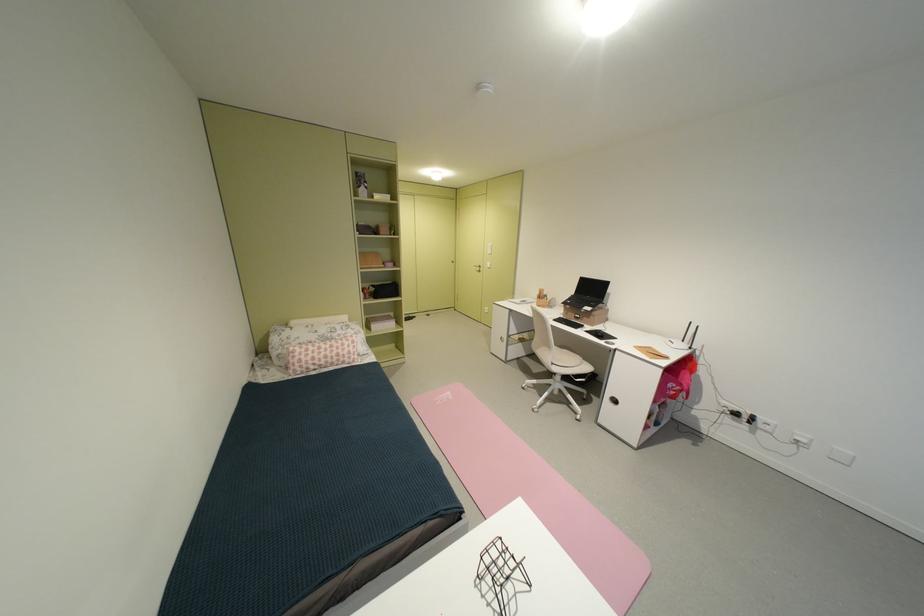
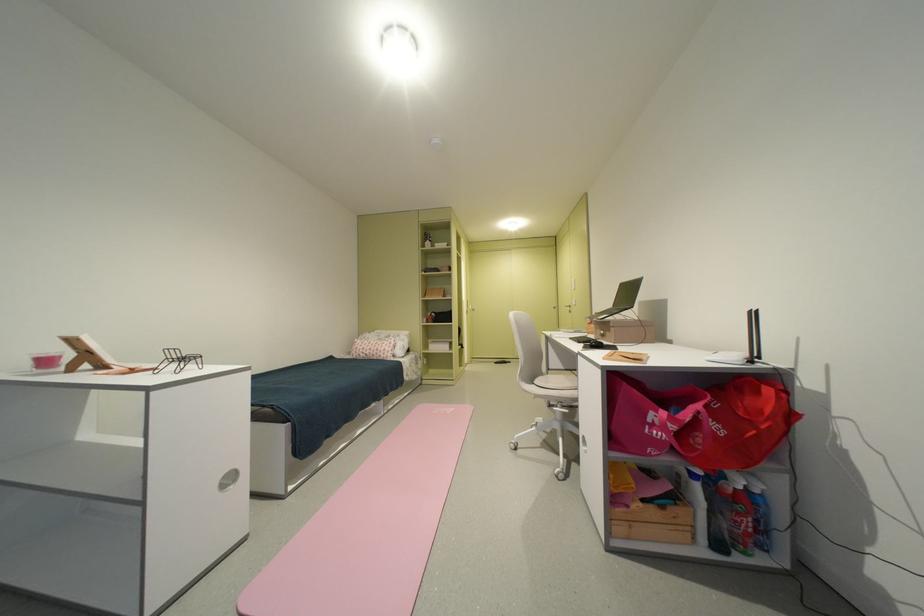
Locate, in the second image, the point that corresponds to pixel 499 268 in the first image.

(584, 305)